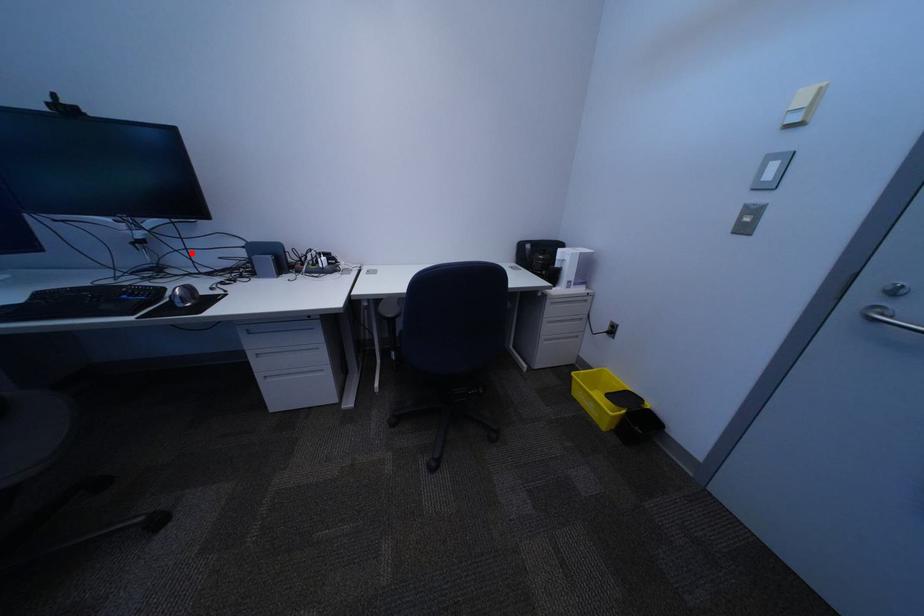
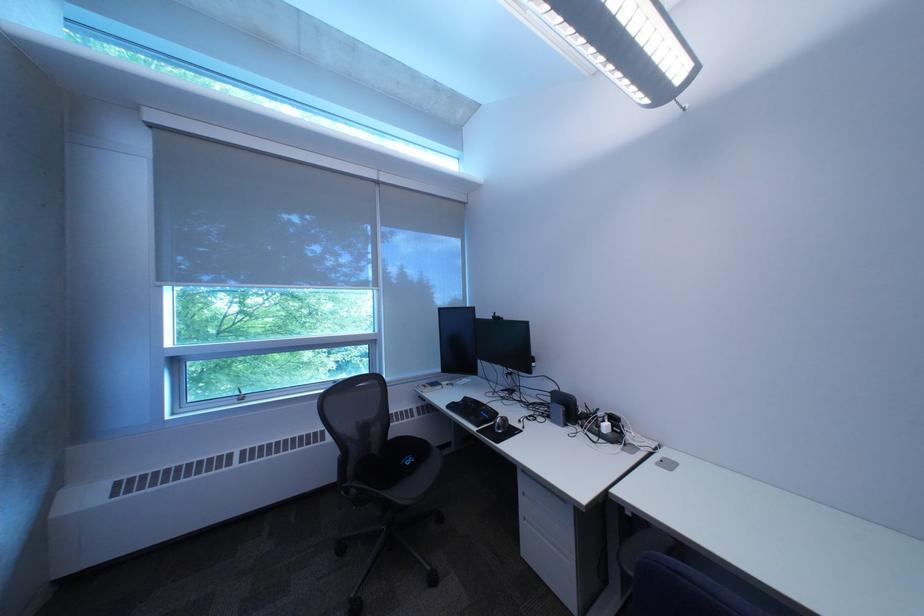
Question: A red point is marked in image1. In image2, is the corresponding 3D point closer to the camera or farther? Reply with the corresponding letter.

Choices:
 (A) The corresponding 3D point is closer.
 (B) The corresponding 3D point is farther.

Answer: (B)